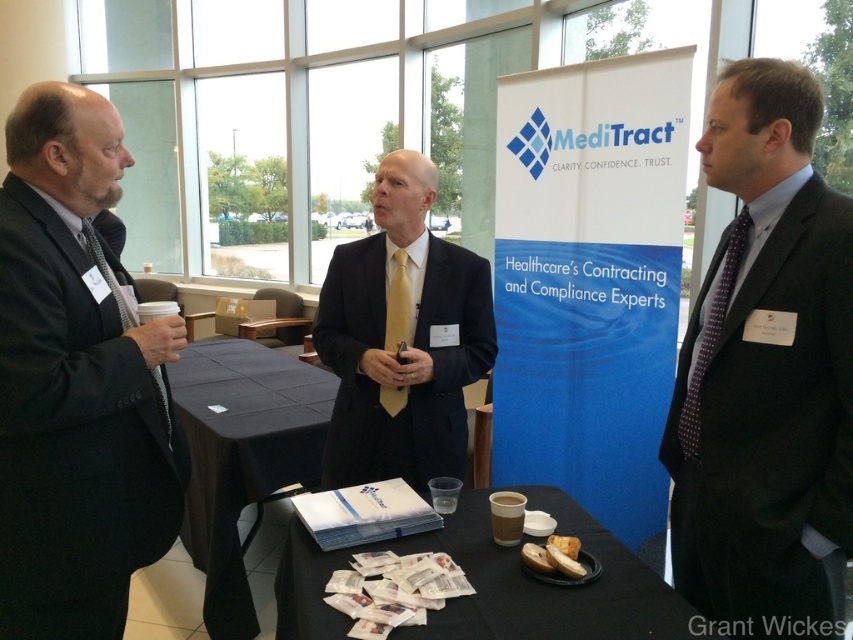
How far apart are matte black suit at center and brown paper cup at center?

22.73 inches

Can you confirm if matte black suit at center is positioned below brown paper cup at center?

Incorrect, matte black suit at center is not positioned below brown paper cup at center.

What do you see at coordinates (402, 339) in the screenshot? I see `matte black suit at center` at bounding box center [402, 339].

This screenshot has width=853, height=640. Find the location of `matte black suit at center`. matte black suit at center is located at coordinates (402, 339).

Between black fabric table at lower left and purple dotted tie at right, which one has more height?

black fabric table at lower left

Is black fabric table at lower left positioned behind purple dotted tie at right?

That is True.

Where is `black fabric table at lower left`? This screenshot has height=640, width=853. black fabric table at lower left is located at coordinates (242, 458).

Looking at this image, can you confirm if dark gray suit at right is shorter than black paper plate at center?

Incorrect, dark gray suit at right's height does not fall short of black paper plate at center's.

Is point (747, 454) closer to camera compared to point (665, 600)?

No, (747, 454) is further to viewer.

This screenshot has height=640, width=853. I want to click on dark gray suit at right, so click(764, 372).